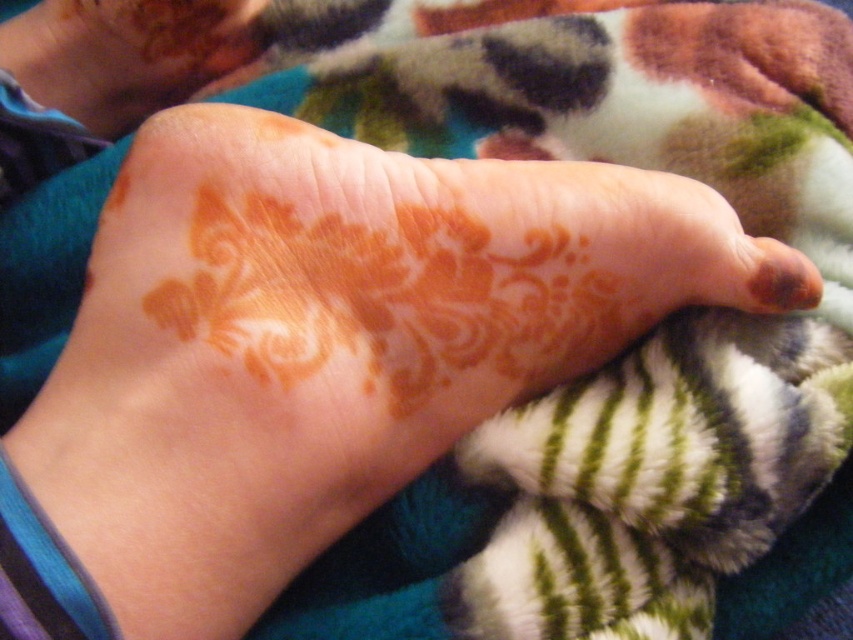
You are an artist trying to replicate the henna design on your own foot. The orange henna tattoo at center is represented by point (125,54). Can you determine the exact coordinates of the orange henna tattoo at center?

The orange henna tattoo at center is represented by point (125,54).

You are holding a small 12 inch ruler and want to measure the distance from your eye to the point at coordinates point (146, 36). Can you reach it with your ruler?

The point at coordinates point (146, 36) is 16.46 inches from the viewer, so the 12 inch ruler is not long enough to reach it.

You are an artist planning to replicate the orange henna tattoo at center and the brown matte toe at center on a canvas. Which of the two designs should you focus on first if you want to start with the larger one?

The orange henna tattoo at center is larger in size than the brown matte toe at center, so you should focus on replicating the orange henna tattoo at center first.